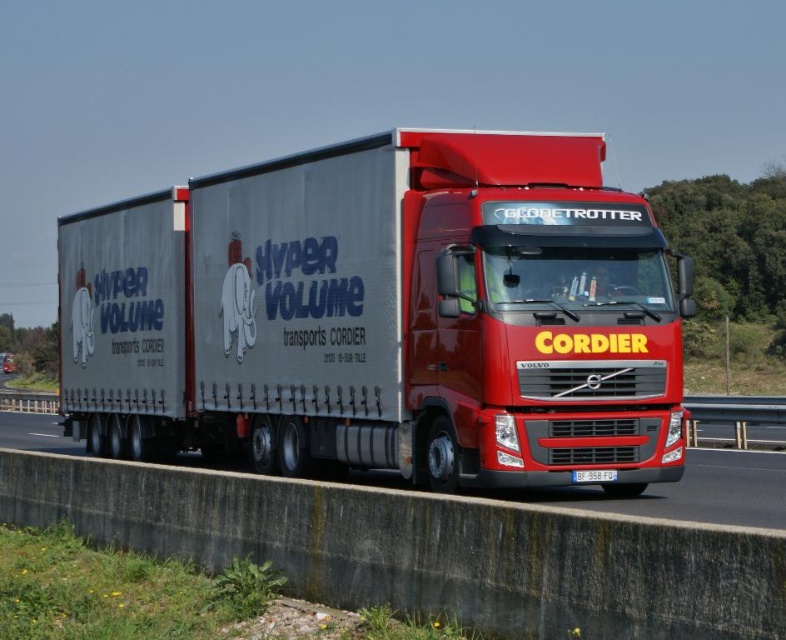
You are a delivery driver who needs to park the red Volvo Globetrotter truck on the metallic gray highway at center. The parking space available is exactly 3.4 meters long. Can the trailer of the metallic silver trailer at center fit into this space?

The metallic silver trailer at center is 3.43 meters away from the metallic gray highway at center. Since the parking space is only 3.4 meters long, the trailer cannot fit into the space as it is slightly longer than the available length.

Where is the metallic gray highway at center located in the image?

The metallic gray highway at center is located at point (703,483) in the image.